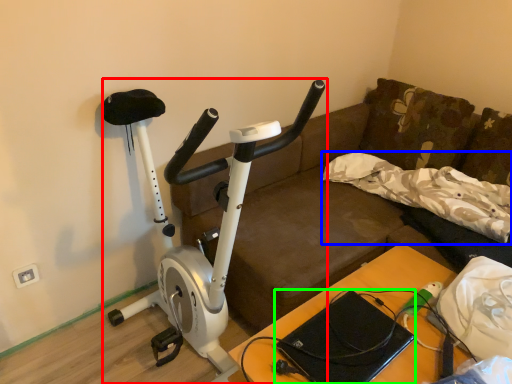
Question: Based on their relative distances, which object is nearer to stationary bicycle (highlighted by a red box)? Choose from pillow (highlighted by a blue box) and laptop (highlighted by a green box).

Choices:
 (A) pillow
 (B) laptop

Answer: (B)